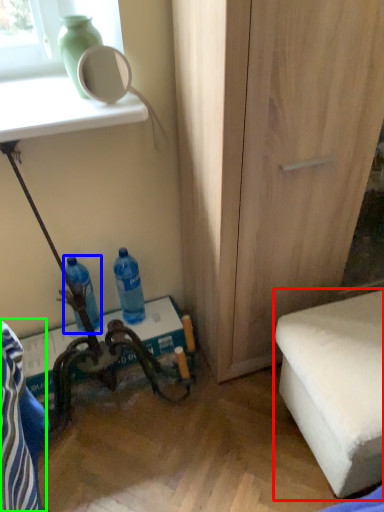
Question: Based on their relative distances, which object is farther from furniture (highlighted by a red box)? Choose from bottle (highlighted by a blue box) and swivel chair (highlighted by a green box).

Choices:
 (A) bottle
 (B) swivel chair

Answer: (A)